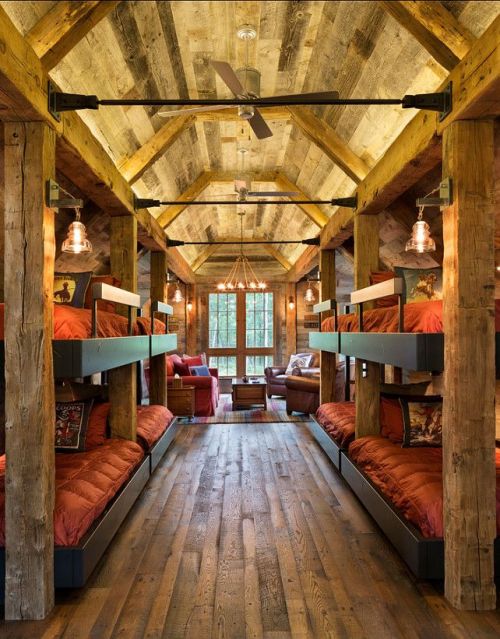
What are the coordinates of `table` in the screenshot? It's located at (249, 387).